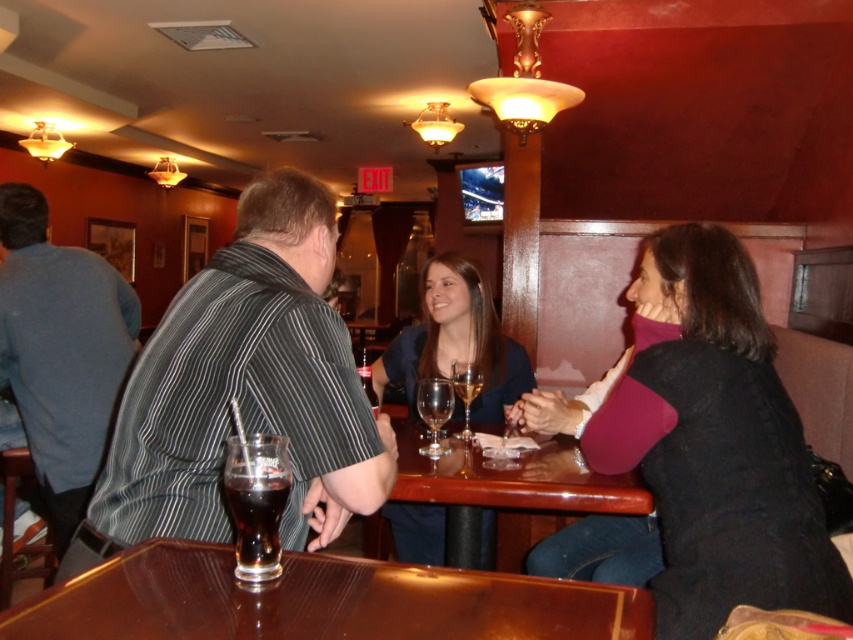
The image size is (853, 640). Find the location of `transparent glass wine glass at center`. transparent glass wine glass at center is located at coordinates [x=434, y=410].

Which of these two, transparent glass wine glass at center or translucent glass wine glass at center, stands shorter?

transparent glass wine glass at center is shorter.

Which is in front, point (444, 388) or point (461, 364)?

Point (444, 388) is in front.

Find the location of a particular element. This screenshot has width=853, height=640. transparent glass wine glass at center is located at coordinates (434, 410).

Can you confirm if gray sweater at left is positioned to the left of glossy wood table at center?

Correct, you'll find gray sweater at left to the left of glossy wood table at center.

Is point (128, 326) farther from camera compared to point (412, 440)?

Yes.

Who is more forward, (28, 333) or (426, 499)?

Positioned in front is point (426, 499).

This screenshot has height=640, width=853. I want to click on gray sweater at left, so click(x=61, y=353).

Can you confirm if shiny brown wood table at center is positioned to the left of transparent glass wine glass at center?

Correct, you'll find shiny brown wood table at center to the left of transparent glass wine glass at center.

Can you confirm if shiny brown wood table at center is positioned to the right of transparent glass wine glass at center?

In fact, shiny brown wood table at center is to the left of transparent glass wine glass at center.

You are a GUI agent. You are given a task and a screenshot of the screen. Output one action in this format:
    pyautogui.click(x=<x>, y=<y>)
    Task: Click on the shiny brown wood table at center
    The image size is (853, 640).
    Given the screenshot: What is the action you would take?
    pyautogui.click(x=318, y=602)